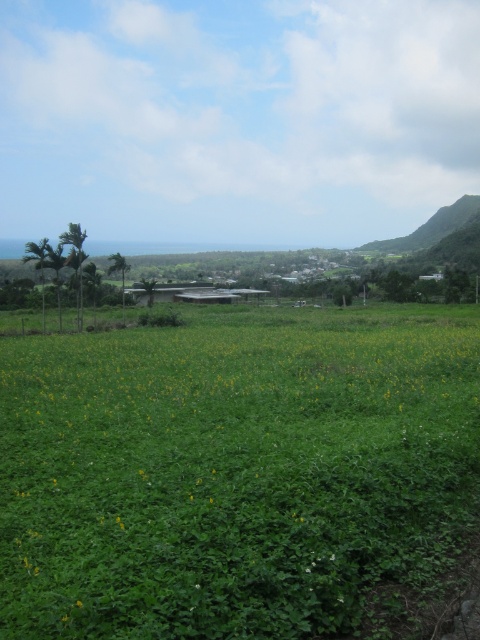
Question: Is green grassy field at center above yellow matte flower at center?

Choices:
 (A) yes
 (B) no

Answer: (A)

Question: Does green grassy field at center appear on the left side of yellow matte flower at center?

Choices:
 (A) yes
 (B) no

Answer: (B)

Question: Does green grassy field at center have a larger size compared to yellow matte flower at center?

Choices:
 (A) yes
 (B) no

Answer: (A)

Question: Which object is closer to the camera taking this photo?

Choices:
 (A) yellow matte flower at center
 (B) green grassy field at center

Answer: (B)